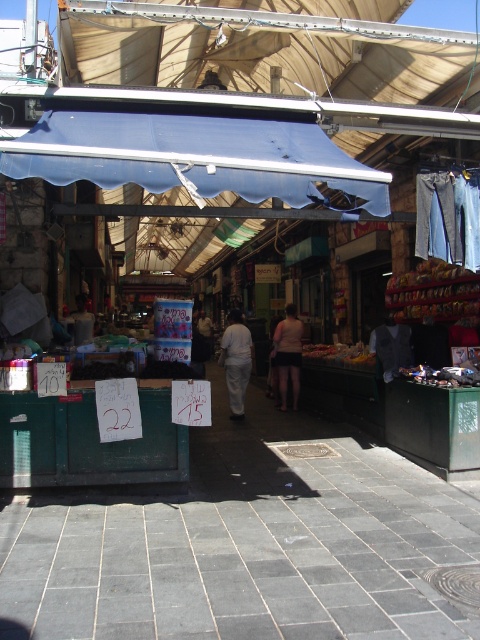
You are a traveler trying to decide between the white cotton pants at center and the light beige shorts at center. Which item is shorter?

The white cotton pants at center is shorter than the light beige shorts at center.

You are a customer at the market and want to buy both the white cotton pants at center and the light beige shorts at center. Which item is positioned closer to you?

The white cotton pants at center is closer to the viewer than the light beige shorts at center.